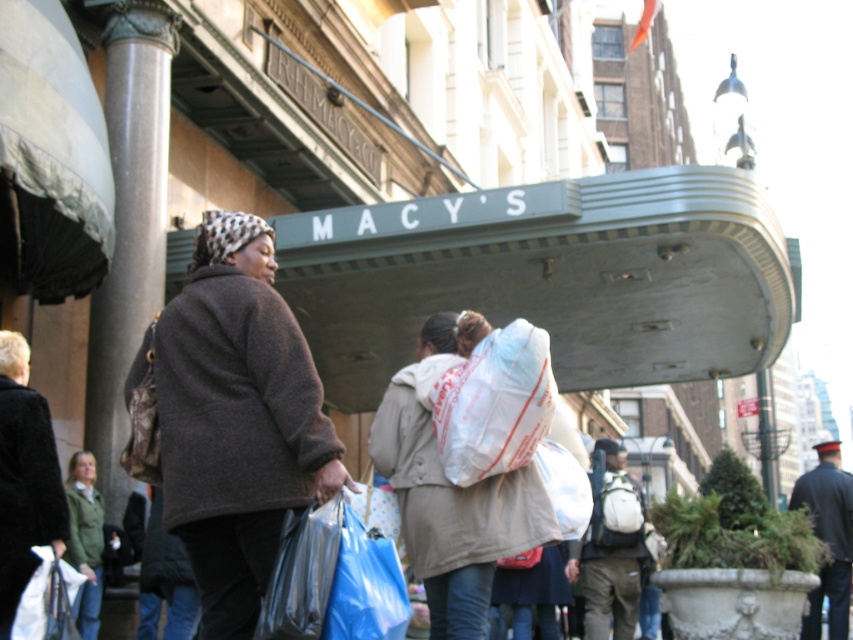
Question: Where is blue plastic bag at lower center located in relation to green matte jacket at lower left in the image?

Choices:
 (A) left
 (B) right

Answer: (B)

Question: Among these points, which one is farthest from the camera?

Choices:
 (A) (268, 541)
 (B) (41, 596)
 (C) (413, 524)
 (D) (326, 602)

Answer: (C)

Question: Does white plastic bag at center have a smaller size compared to translucent plastic bag at lower left?

Choices:
 (A) yes
 (B) no

Answer: (B)

Question: Which object appears closest to the camera in this image?

Choices:
 (A) blue plastic bag at lower center
 (B) translucent plastic bag at lower left
 (C) green matte jacket at lower left
 (D) matte white backpack at center

Answer: (A)

Question: Is beige fabric coat at center to the right of green matte jacket at lower left from the viewer's perspective?

Choices:
 (A) yes
 (B) no

Answer: (A)

Question: Which object is farther from the camera taking this photo?

Choices:
 (A) beige fabric coat at center
 (B) blue plastic bag at lower center
 (C) shiny plastic bag at lower center

Answer: (A)